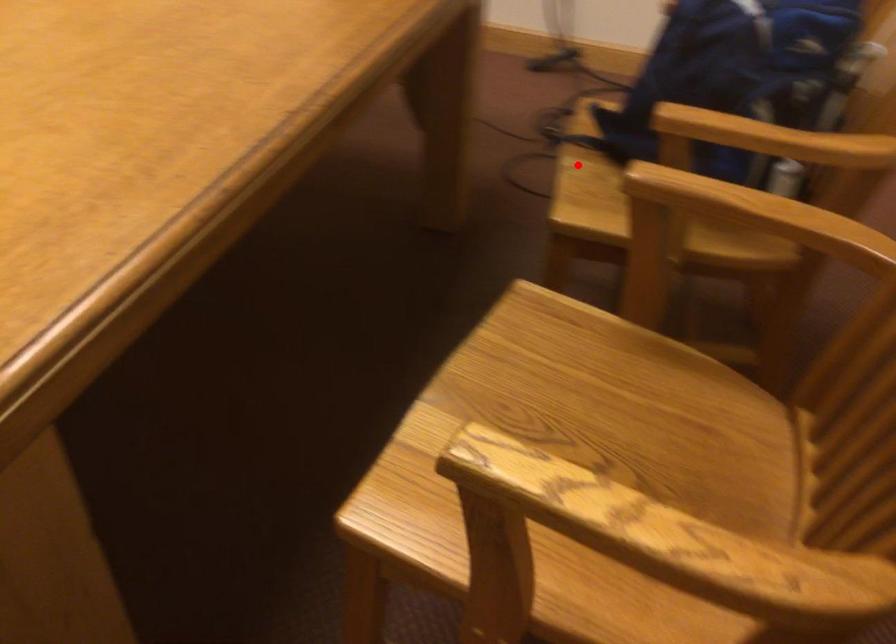
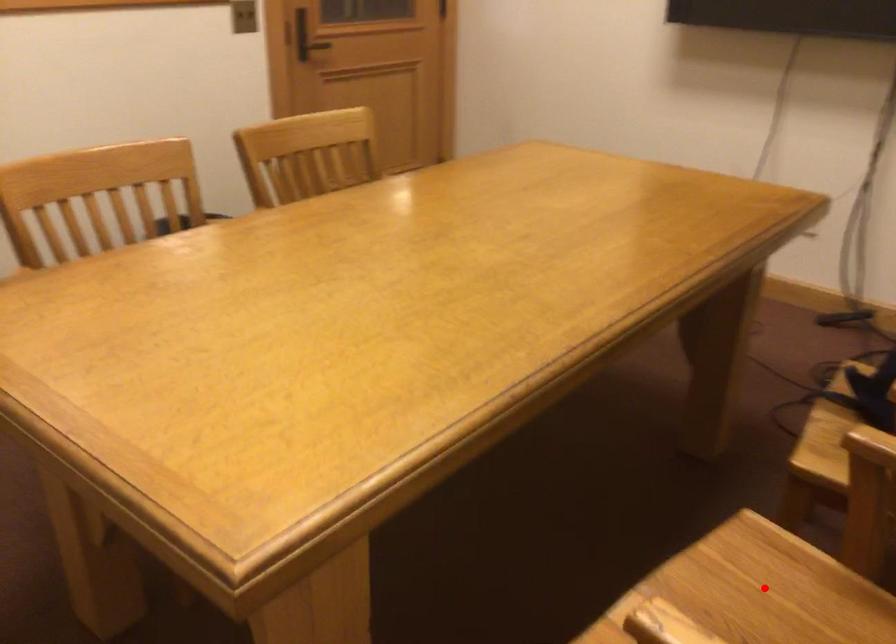
I am providing you with two images of the same scene from different viewpoints. A red point is marked on the first image and another point is marked on the second image. Does the point marked in image1 correspond to the same location as the one in image2?

No